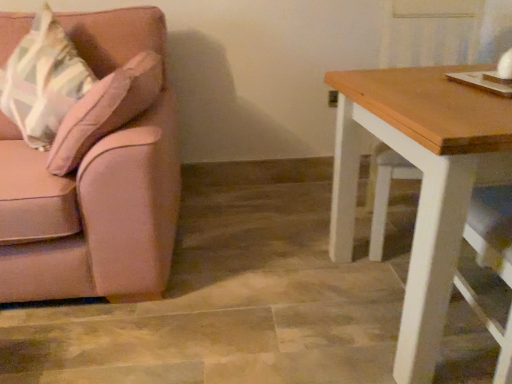
Question: Considering the relative sizes of pink fabric couch at left and matte pink throw pillow at left in the image provided, is pink fabric couch at left thinner than matte pink throw pillow at left?

Choices:
 (A) yes
 (B) no

Answer: (B)

Question: Does pink fabric couch at left have a greater width compared to matte pink throw pillow at left?

Choices:
 (A) no
 (B) yes

Answer: (B)

Question: From a real-world perspective, is pink fabric couch at left positioned over matte pink throw pillow at left based on gravity?

Choices:
 (A) no
 (B) yes

Answer: (A)

Question: Does pink fabric couch at left turn towards matte pink throw pillow at left?

Choices:
 (A) yes
 (B) no

Answer: (A)

Question: Is pink fabric couch at left smaller than matte pink throw pillow at left?

Choices:
 (A) no
 (B) yes

Answer: (A)

Question: Is matte pink throw pillow at left surrounded by pink fabric couch at left?

Choices:
 (A) no
 (B) yes

Answer: (B)

Question: From the image's perspective, does wooden table at right appear higher than matte pink throw pillow at left?

Choices:
 (A) yes
 (B) no

Answer: (B)

Question: Is wooden table at right next to matte pink throw pillow at left and touching it?

Choices:
 (A) no
 (B) yes

Answer: (A)

Question: Can you confirm if wooden table at right is thinner than matte pink throw pillow at left?

Choices:
 (A) no
 (B) yes

Answer: (A)

Question: Is wooden table at right facing towards matte pink throw pillow at left?

Choices:
 (A) yes
 (B) no

Answer: (B)

Question: From the image's perspective, is wooden table at right located beneath matte pink throw pillow at left?

Choices:
 (A) no
 (B) yes

Answer: (B)

Question: Is wooden table at right behind matte pink throw pillow at left?

Choices:
 (A) yes
 (B) no

Answer: (B)

Question: Could you tell me if wooden table at right is facing pink fabric couch at left?

Choices:
 (A) no
 (B) yes

Answer: (A)